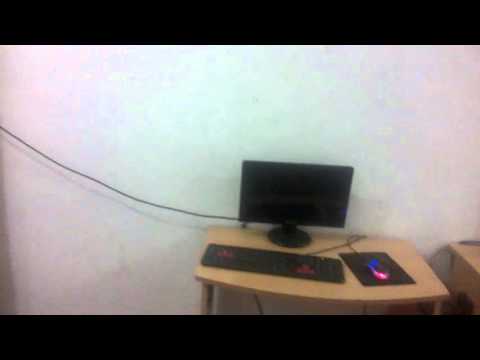
You are a GUI agent. You are given a task and a screenshot of the screen. Output one action in this format:
    pyautogui.click(x=<x>, y=<y>)
    Task: Click on the mouse pad
    This screenshot has height=360, width=480.
    Given the screenshot: What is the action you would take?
    pyautogui.click(x=356, y=260)